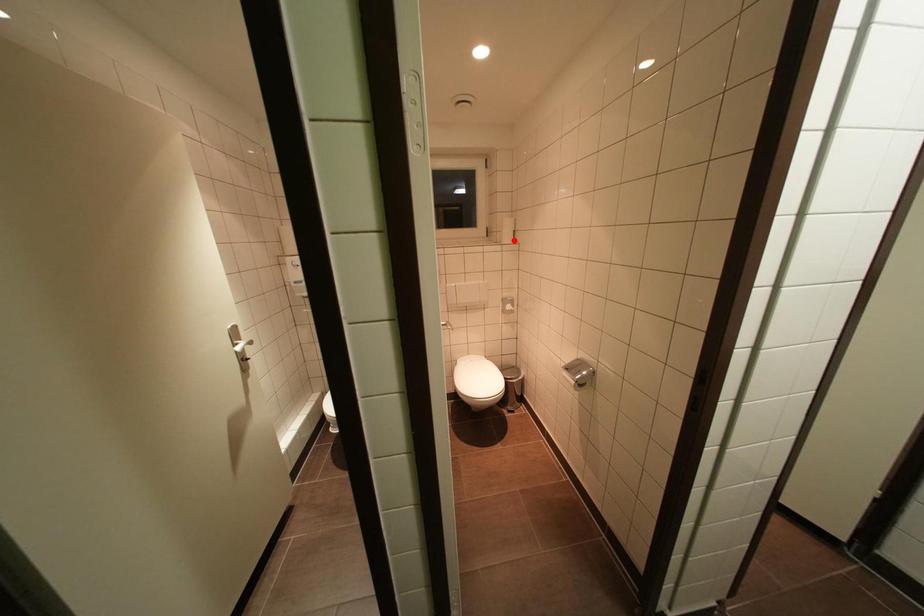
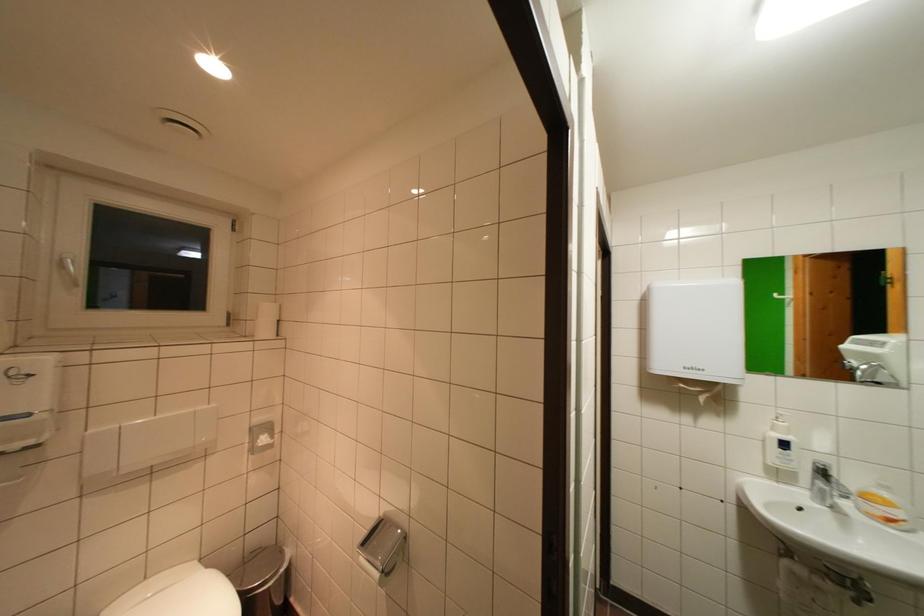
Question: I am providing you with two images of the same scene from different viewpoints. A red point is marked on the first image. Can you still see the location of the red point in image 2?

Choices:
 (A) Yes
 (B) No

Answer: (A)